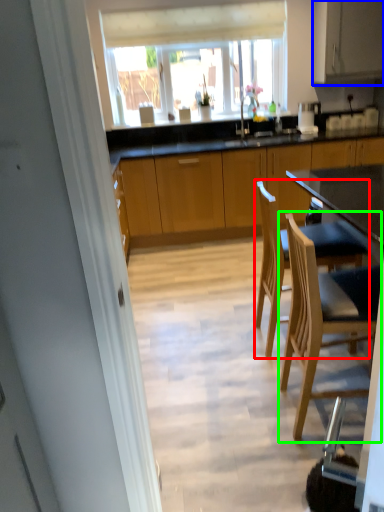
Question: Considering the real-world distances, which object is closest to chair (highlighted by a red box)? cabinetry (highlighted by a blue box) or chair (highlighted by a green box).

Choices:
 (A) cabinetry
 (B) chair

Answer: (B)